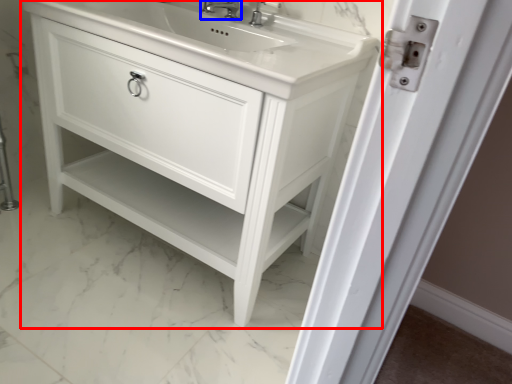
Question: Which object is further to the camera taking this photo, bathroom cabinet (highlighted by a red box) or tap (highlighted by a blue box)?

Choices:
 (A) bathroom cabinet
 (B) tap

Answer: (B)